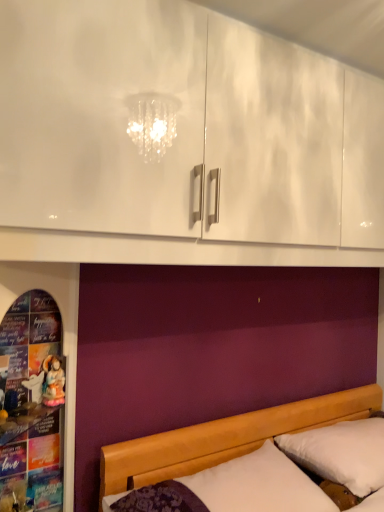
Question: From a real-world perspective, is wooden bed at lower right under matte porcelain doll at left?

Choices:
 (A) yes
 (B) no

Answer: (A)

Question: Does wooden bed at lower right have a greater height compared to matte porcelain doll at left?

Choices:
 (A) yes
 (B) no

Answer: (A)

Question: From the image's perspective, does wooden bed at lower right appear higher than matte porcelain doll at left?

Choices:
 (A) no
 (B) yes

Answer: (A)

Question: Is matte porcelain doll at left at the back of wooden bed at lower right?

Choices:
 (A) yes
 (B) no

Answer: (B)

Question: Can you confirm if wooden bed at lower right is shorter than matte porcelain doll at left?

Choices:
 (A) no
 (B) yes

Answer: (A)

Question: Relative to matte porcelain doll at left, is white soft pillow at lower right in front or behind?

Choices:
 (A) behind
 (B) front

Answer: (A)

Question: From a real-world perspective, relative to matte porcelain doll at left, is white soft pillow at lower right vertically above or below?

Choices:
 (A) below
 (B) above

Answer: (A)

Question: From the image's perspective, is white soft pillow at lower right above or below matte porcelain doll at left?

Choices:
 (A) above
 (B) below

Answer: (B)

Question: In the image, is white soft pillow at lower right on the left side or the right side of matte porcelain doll at left?

Choices:
 (A) left
 (B) right

Answer: (B)

Question: Does point (220, 422) appear closer or farther from the camera than point (49, 380)?

Choices:
 (A) farther
 (B) closer

Answer: (A)

Question: From the image's perspective, is wooden bed at lower right above or below matte porcelain doll at left?

Choices:
 (A) above
 (B) below

Answer: (B)

Question: From a real-world perspective, is wooden bed at lower right positioned above or below matte porcelain doll at left?

Choices:
 (A) below
 (B) above

Answer: (A)

Question: Considering the relative positions of wooden bed at lower right and matte porcelain doll at left in the image provided, is wooden bed at lower right to the left or to the right of matte porcelain doll at left?

Choices:
 (A) left
 (B) right

Answer: (B)

Question: From their relative heights in the image, would you say matte porcelain doll at left is taller or shorter than white soft pillow at lower right?

Choices:
 (A) short
 (B) tall

Answer: (A)

Question: In terms of size, does matte porcelain doll at left appear bigger or smaller than white soft pillow at lower right?

Choices:
 (A) big
 (B) small

Answer: (B)